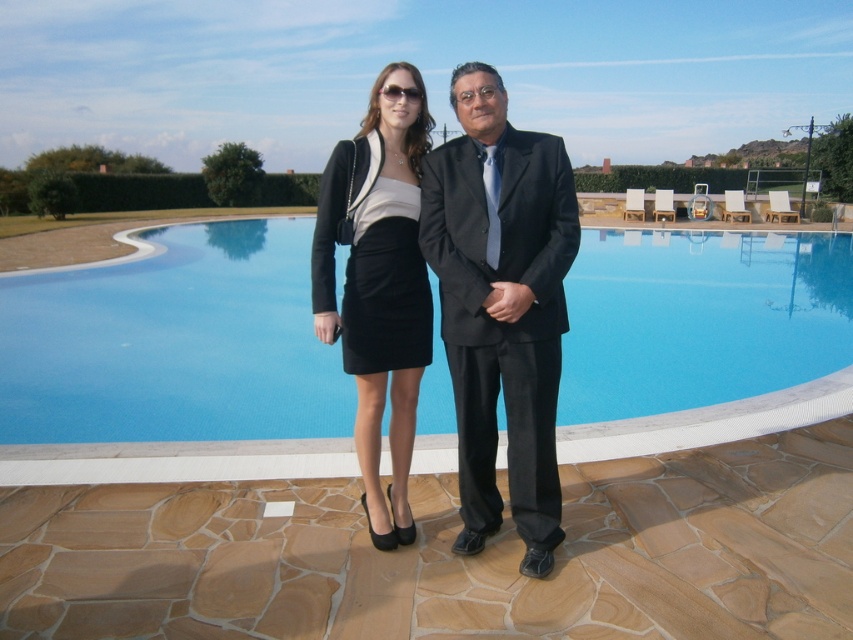
You are a photographer planning to take a portrait of the two people in the scene. You want to ensure that the matte black suit at center and the matte black skirt at center are both clearly visible in the frame. Based on their positions, which one should you focus on first to ensure proper focus?

The matte black skirt at center should be focused on first because it is above the matte black suit at center, making it closer to the camera.